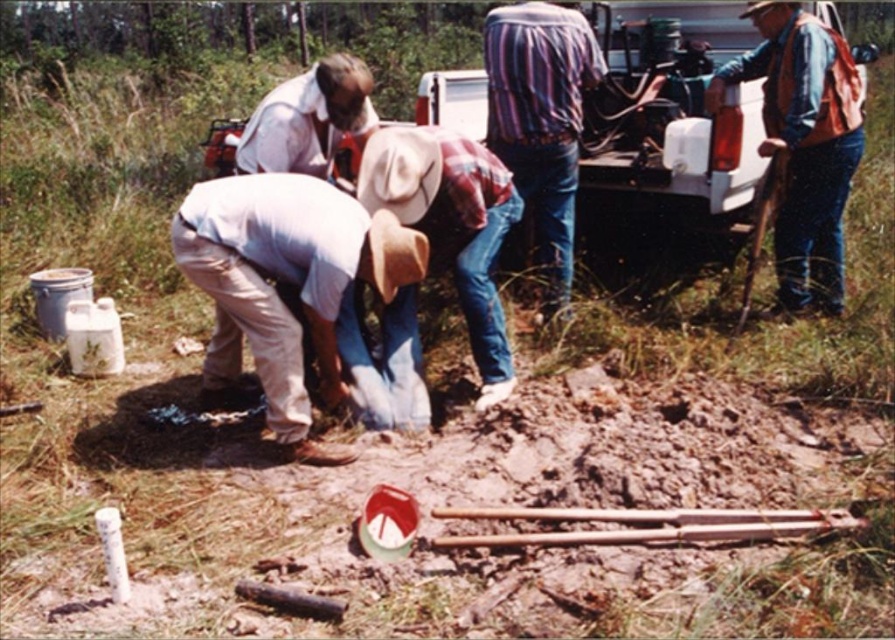
Question: Among these objects, which one is nearest to the camera?

Choices:
 (A) brown canvas safety vest at right
 (B) striped fabric shirt at center
 (C) white plastic truck at upper right

Answer: (A)

Question: Which of these objects is positioned farthest from the white plastic truck at upper right?

Choices:
 (A) matte white shirt at center
 (B) white cotton shirt at center
 (C) striped fabric shirt at center
 (D) brown canvas safety vest at right

Answer: (A)

Question: Is brown canvas safety vest at right positioned at the back of white cotton shirt at center?

Choices:
 (A) no
 (B) yes

Answer: (B)

Question: Is striped fabric shirt at center further to the viewer compared to matte white shirt at center?

Choices:
 (A) yes
 (B) no

Answer: (A)

Question: Considering the relative positions of white cotton shirt at center and matte white shirt at center in the image provided, where is white cotton shirt at center located with respect to matte white shirt at center?

Choices:
 (A) left
 (B) right

Answer: (B)

Question: Among these points, which one is farthest from the camera?

Choices:
 (A) (324, 67)
 (B) (667, 113)
 (C) (454, 148)
 (D) (797, 108)

Answer: (B)